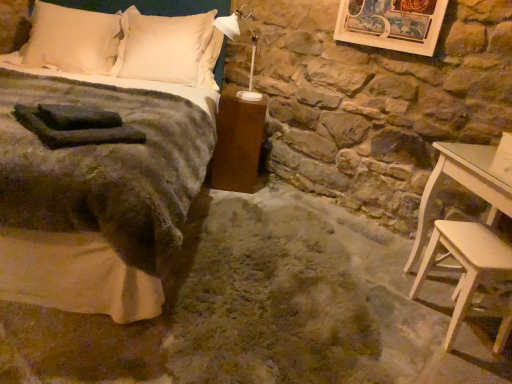
Question: Is white soft pillow at upper left, arranged as the 2th pillow when viewed from the right, bigger than light beige wood stool at lower right?

Choices:
 (A) yes
 (B) no

Answer: (A)

Question: Is white soft pillow at upper left, arranged as the 2th pillow when viewed from the right, not close to light beige wood stool at lower right?

Choices:
 (A) yes
 (B) no

Answer: (A)

Question: From the image's perspective, is white soft pillow at upper left, arranged as the 2th pillow when viewed from the right, under light beige wood stool at lower right?

Choices:
 (A) no
 (B) yes

Answer: (A)

Question: Considering the relative sizes of white soft pillow at upper left, arranged as the 2th pillow when viewed from the right, and light beige wood stool at lower right in the image provided, is white soft pillow at upper left, arranged as the 2th pillow when viewed from the right, shorter than light beige wood stool at lower right?

Choices:
 (A) no
 (B) yes

Answer: (A)

Question: Is the depth of white soft pillow at upper left, arranged as the 2th pillow when viewed from the right, less than that of light beige wood stool at lower right?

Choices:
 (A) yes
 (B) no

Answer: (B)

Question: From the image's perspective, is white soft pillow at upper left, which is counted as the 1th pillow, starting from the left, above light beige wood stool at lower right?

Choices:
 (A) yes
 (B) no

Answer: (A)

Question: Is white soft pillow at upper left, which is counted as the 1th pillow, starting from the left, not inside brown matte nightstand at lower center?

Choices:
 (A) yes
 (B) no

Answer: (A)

Question: Is white soft pillow at upper left, which is counted as the 1th pillow, starting from the left, smaller than brown matte nightstand at lower center?

Choices:
 (A) yes
 (B) no

Answer: (B)

Question: Is white soft pillow at upper left, arranged as the 2th pillow when viewed from the right, positioned far away from brown matte nightstand at lower center?

Choices:
 (A) yes
 (B) no

Answer: (A)

Question: Does white soft pillow at upper left, which is counted as the 1th pillow, starting from the left, have a lesser height compared to brown matte nightstand at lower center?

Choices:
 (A) no
 (B) yes

Answer: (B)

Question: Is white soft pillow at upper left, which is counted as the 1th pillow, starting from the left, directly adjacent to brown matte nightstand at lower center?

Choices:
 (A) yes
 (B) no

Answer: (B)

Question: Is white soft pillow at upper left, arranged as the 2th pillow when viewed from the right, thinner than brown matte nightstand at lower center?

Choices:
 (A) no
 (B) yes

Answer: (A)

Question: Is satin white pillow at upper center, the first pillow from the right, completely or partially inside light beige wood stool at lower right?

Choices:
 (A) yes
 (B) no

Answer: (B)